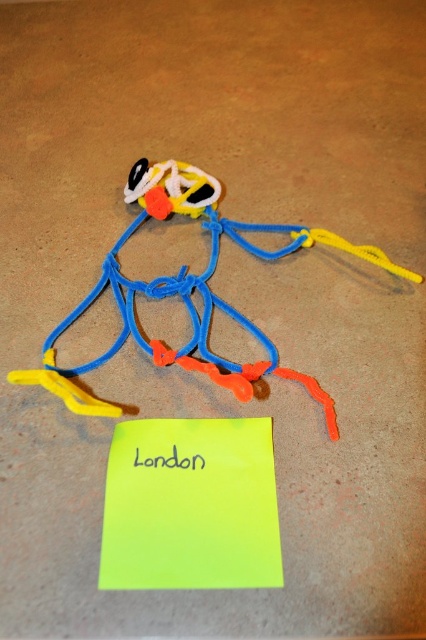
Question: Which object is farther from the camera taking this photo?

Choices:
 (A) yellow paper at lower center
 (B) flexible plastic toy at center

Answer: (A)

Question: Which point appears closest to the camera in this image?

Choices:
 (A) (183, 460)
 (B) (132, 221)

Answer: (A)

Question: Can you confirm if flexible plastic toy at center is smaller than yellow paper at lower center?

Choices:
 (A) no
 (B) yes

Answer: (A)

Question: Is flexible plastic toy at center closer to camera compared to yellow paper at lower center?

Choices:
 (A) yes
 (B) no

Answer: (A)

Question: Can you confirm if flexible plastic toy at center is bigger than yellow paper at lower center?

Choices:
 (A) yes
 (B) no

Answer: (A)

Question: Which object is farther from the camera taking this photo?

Choices:
 (A) yellow paper at lower center
 (B) flexible plastic toy at center

Answer: (A)